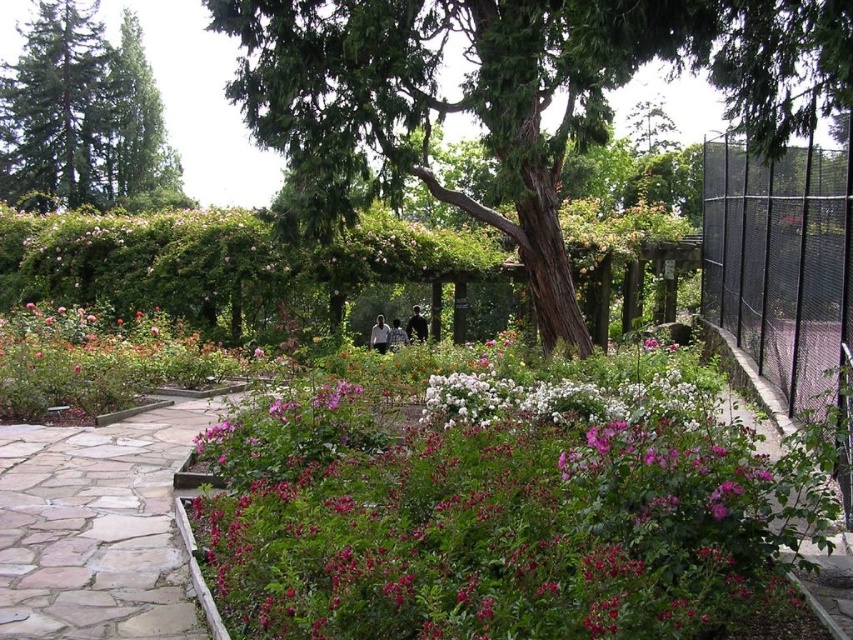
Between pink matte flowers at center and black chain-link fence at right, which one is positioned higher?

black chain-link fence at right is higher up.

Based on the photo, between pink matte flowers at center and black chain-link fence at right, which one has more height?

Standing taller between the two is black chain-link fence at right.

Find the location of a particular element. pink matte flowers at center is located at coordinates (489, 515).

Is green rough bark tree at center to the right of green glossy tree at upper left from the viewer's perspective?

Yes, green rough bark tree at center is to the right of green glossy tree at upper left.

Who is taller, green rough bark tree at center or green glossy tree at upper left?

With more height is green glossy tree at upper left.

You are a GUI agent. You are given a task and a screenshot of the screen. Output one action in this format:
    pyautogui.click(x=<x>, y=<y>)
    Task: Click on the green rough bark tree at center
    
    Given the screenshot: What is the action you would take?
    pyautogui.click(x=508, y=97)

Does green rough bark tree at center appear over black chain-link fence at right?

Yes.

Who is higher up, green rough bark tree at center or black chain-link fence at right?

Positioned higher is green rough bark tree at center.

Locate an element on the screen. This screenshot has height=640, width=853. green rough bark tree at center is located at coordinates (508, 97).